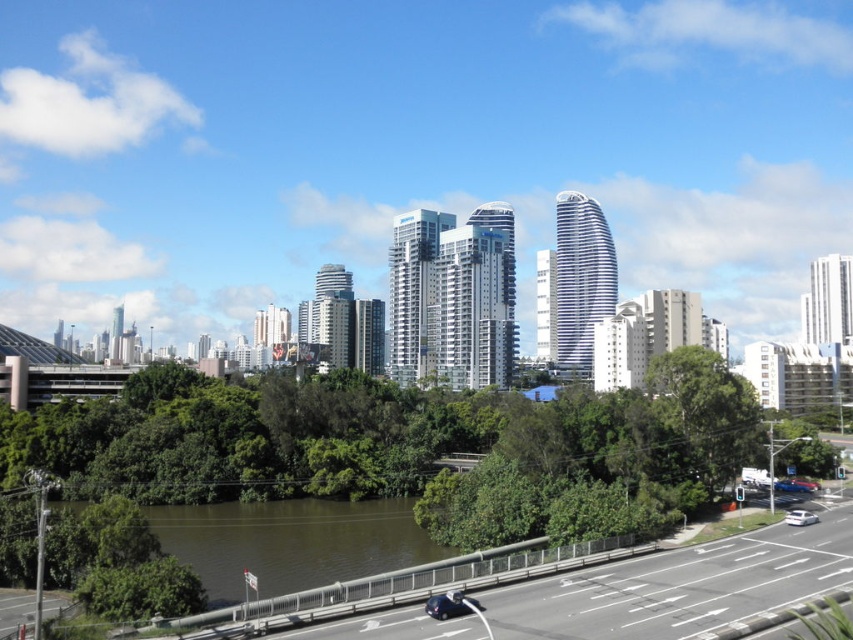
Question: Which point is closer to the camera taking this photo?

Choices:
 (A) (804, 516)
 (B) (666, 417)
 (C) (779, 480)
 (D) (151, 509)

Answer: (A)

Question: Does greenish-brown water at center have a smaller size compared to green leafy tree at center?

Choices:
 (A) no
 (B) yes

Answer: (A)

Question: Can you confirm if shiny blue car at lower center is smaller than blue metallic car at lower right?

Choices:
 (A) yes
 (B) no

Answer: (A)

Question: Which point is farther from the camera taking this photo?

Choices:
 (A) pos(287,586)
 (B) pos(669,406)

Answer: (B)

Question: Is greenish-brown water at center closer to camera compared to green leafy tree at center?

Choices:
 (A) no
 (B) yes

Answer: (B)

Question: Which of these objects is positioned farthest from the shiny blue car at lower center?

Choices:
 (A) blue metallic car at lower right
 (B) greenish-brown water at center

Answer: (A)